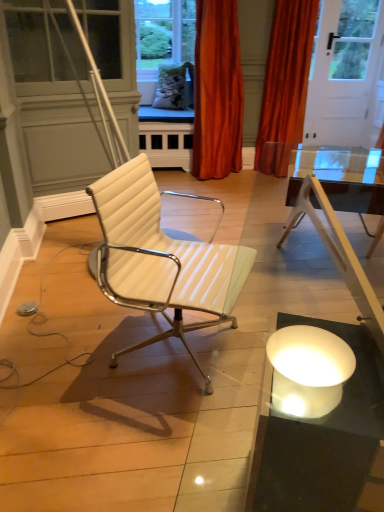
Question: Considering the relative positions of white leather chair at center and orange velvet curtain at upper center, which is the second curtain from right to left, in the image provided, is white leather chair at center behind orange velvet curtain at upper center, which is the second curtain from right to left,?

Choices:
 (A) yes
 (B) no

Answer: (B)

Question: Is white leather chair at center not near orange velvet curtain at upper center, acting as the first curtain starting from the left?

Choices:
 (A) no
 (B) yes

Answer: (B)

Question: Is white leather chair at center at the left side of orange velvet curtain at upper center, which is the second curtain from right to left?

Choices:
 (A) yes
 (B) no

Answer: (A)

Question: Is white leather chair at center aimed at orange velvet curtain at upper center, which is the second curtain from right to left?

Choices:
 (A) no
 (B) yes

Answer: (A)

Question: Does white leather chair at center have a smaller size compared to orange velvet curtain at upper center, which is the second curtain from right to left?

Choices:
 (A) no
 (B) yes

Answer: (B)

Question: Is white leather chair at center taller than orange velvet curtain at upper center, acting as the first curtain starting from the left?

Choices:
 (A) no
 (B) yes

Answer: (A)

Question: Can you confirm if orange velvet curtain at upper right, the second curtain when ordered from left to right, is smaller than orange velvet curtain at upper center, which is the second curtain from right to left?

Choices:
 (A) yes
 (B) no

Answer: (A)

Question: Is orange velvet curtain at upper right, the second curtain when ordered from left to right, to the right of orange velvet curtain at upper center, acting as the first curtain starting from the left, from the viewer's perspective?

Choices:
 (A) yes
 (B) no

Answer: (A)

Question: Is orange velvet curtain at upper right, the second curtain when ordered from left to right, oriented away from orange velvet curtain at upper center, which is the second curtain from right to left?

Choices:
 (A) no
 (B) yes

Answer: (A)

Question: From a real-world perspective, is orange velvet curtain at upper right, the second curtain when ordered from left to right, physically below orange velvet curtain at upper center, acting as the first curtain starting from the left?

Choices:
 (A) yes
 (B) no

Answer: (B)

Question: Does orange velvet curtain at upper right, acting as the 1th curtain starting from the right, lie behind orange velvet curtain at upper center, acting as the first curtain starting from the left?

Choices:
 (A) yes
 (B) no

Answer: (A)

Question: Does orange velvet curtain at upper right, acting as the 1th curtain starting from the right, have a lesser width compared to orange velvet curtain at upper center, which is the second curtain from right to left?

Choices:
 (A) yes
 (B) no

Answer: (A)

Question: Is white leather chair at center completely or partially inside orange velvet curtain at upper center, which is the second curtain from right to left?

Choices:
 (A) no
 (B) yes

Answer: (A)